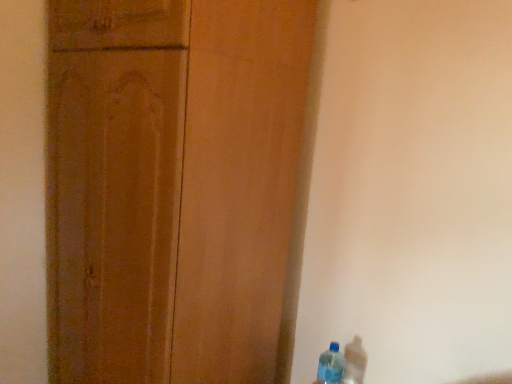
Question: Should I look upward or downward to see wooden cupboard at left?

Choices:
 (A) up
 (B) down

Answer: (B)